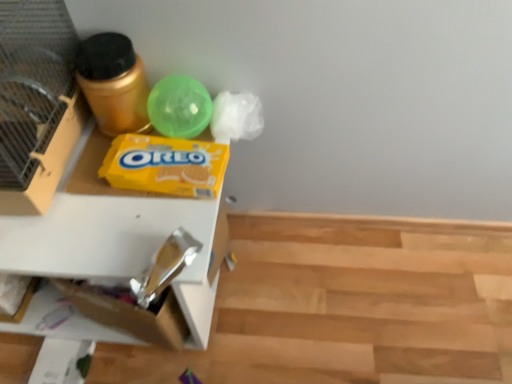
Question: From the image's perspective, would you say translucent green ball at upper center is positioned over gold metallic canister at upper left?

Choices:
 (A) yes
 (B) no

Answer: (B)

Question: Is translucent green ball at upper center facing towards gold metallic canister at upper left?

Choices:
 (A) yes
 (B) no

Answer: (B)

Question: Does translucent green ball at upper center lie behind gold metallic canister at upper left?

Choices:
 (A) yes
 (B) no

Answer: (A)

Question: Could gold metallic canister at upper left be considered to be inside translucent green ball at upper center?

Choices:
 (A) yes
 (B) no

Answer: (B)

Question: Does translucent green ball at upper center come in front of gold metallic canister at upper left?

Choices:
 (A) yes
 (B) no

Answer: (B)

Question: Is yellow cardboard oreo box at center inside the boundaries of translucent green ball at upper center, or outside?

Choices:
 (A) inside
 (B) outside

Answer: (B)

Question: Considering the positions of yellow cardboard oreo box at center and translucent green ball at upper center in the image, is yellow cardboard oreo box at center bigger or smaller than translucent green ball at upper center?

Choices:
 (A) small
 (B) big

Answer: (A)

Question: From the image's perspective, relative to translucent green ball at upper center, is yellow cardboard oreo box at center above or below?

Choices:
 (A) below
 (B) above

Answer: (A)

Question: Considering the positions of point (134, 175) and point (156, 112), is point (134, 175) closer or farther from the camera than point (156, 112)?

Choices:
 (A) farther
 (B) closer

Answer: (B)

Question: From a real-world perspective, relative to brushed metal bird cage at left, is white cardboard drawer at left vertically above or below?

Choices:
 (A) above
 (B) below

Answer: (B)

Question: Considering the positions of point (30, 220) and point (44, 26), is point (30, 220) closer or farther from the camera than point (44, 26)?

Choices:
 (A) closer
 (B) farther

Answer: (A)

Question: Would you say white cardboard drawer at left is to the left or to the right of brushed metal bird cage at left in the picture?

Choices:
 (A) left
 (B) right

Answer: (B)

Question: From the image's perspective, is white cardboard drawer at left above or below brushed metal bird cage at left?

Choices:
 (A) below
 (B) above

Answer: (A)

Question: From a real-world perspective, is brushed metal bird cage at left positioned above or below yellow cardboard oreo box at center?

Choices:
 (A) below
 (B) above

Answer: (B)

Question: Relative to yellow cardboard oreo box at center, is brushed metal bird cage at left in front or behind?

Choices:
 (A) behind
 (B) front

Answer: (B)